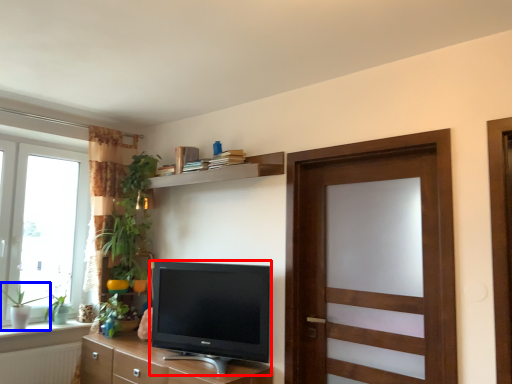
Question: Which point is further to the camera, television (highlighted by a red box) or plant (highlighted by a blue box)?

Choices:
 (A) television
 (B) plant

Answer: (B)